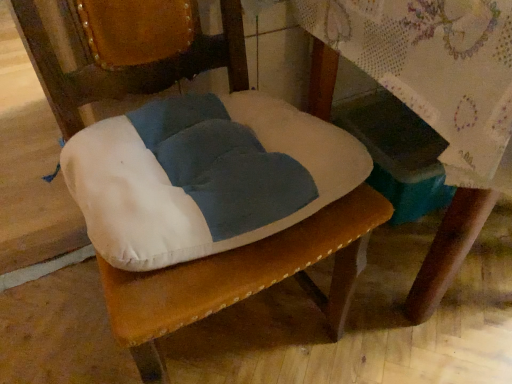
The image size is (512, 384). Describe the element at coordinates (431, 101) in the screenshot. I see `wooden table at lower right` at that location.

This screenshot has width=512, height=384. I want to click on wooden table at lower right, so click(431, 101).

Find the location of `wooden table at lower right`. wooden table at lower right is located at coordinates (431, 101).